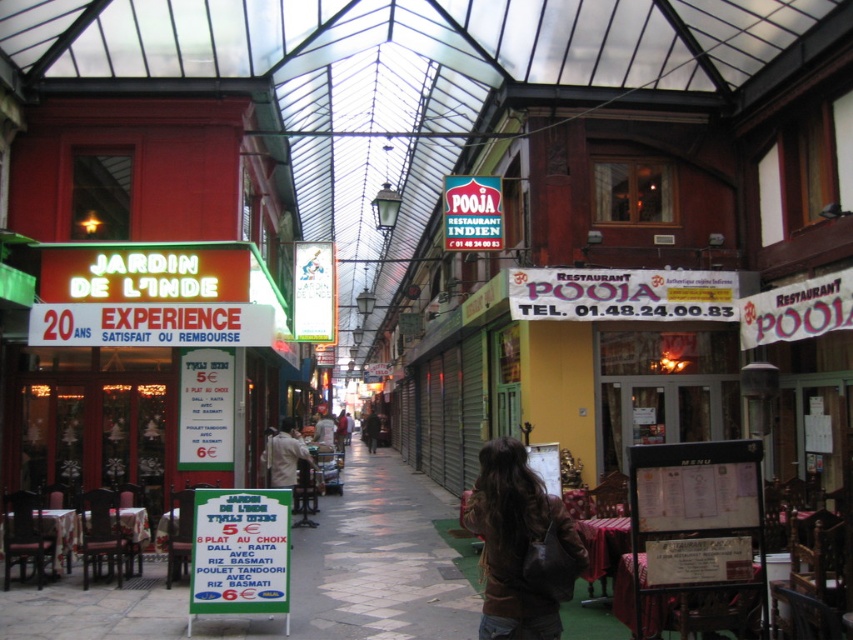
You are standing at the entrance of the arcade and want to read the green plastic signboard at center. Considering the distance, can you read the text on it clearly without moving closer?

The green plastic signboard at center is 8.67 meters away from the camera, so it might be difficult to read the text clearly without moving closer.

You are standing at the entrance of the arcade and want to locate the green plastic signboard at center. Based on the coordinates provided, in which direction should you look relative to your position?

The green plastic signboard at center is located at coordinates 0.863 on the x axis and 0.283 on the y axis. Since the x coordinate is closer to 1, it means it is positioned to the right side of the image. The y coordinate being closer to 0.3 indicates it is near the bottom portion of the image. Therefore, you should look towards the lower right direction from your current position at the entrance.